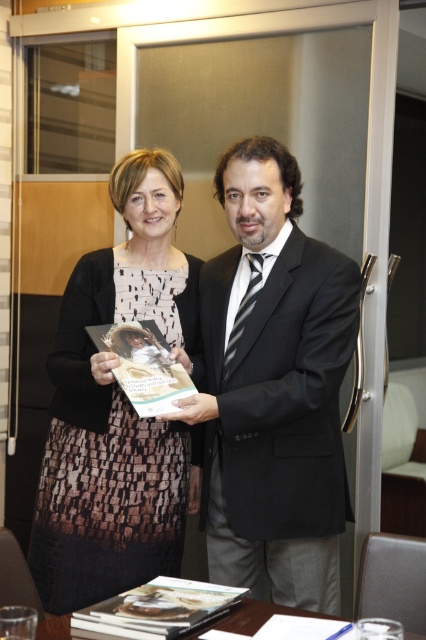
Question: Which of the following is the farthest from the observer?

Choices:
 (A) (49, 621)
 (B) (66, 596)
 (C) (348, 490)

Answer: (B)

Question: Which point is farther to the camera?

Choices:
 (A) black satin suit at center
 (B) wooden table at lower center
 (C) printed fabric dress at center

Answer: (C)

Question: Can you confirm if printed fabric dress at center is positioned to the left of wooden table at lower center?

Choices:
 (A) yes
 (B) no

Answer: (A)

Question: Which of these objects is positioned closest to the black satin suit at center?

Choices:
 (A) wooden table at lower center
 (B) printed fabric dress at center

Answer: (B)

Question: Does black satin suit at center appear over wooden table at lower center?

Choices:
 (A) no
 (B) yes

Answer: (B)

Question: Does printed fabric dress at center have a larger size compared to wooden table at lower center?

Choices:
 (A) no
 (B) yes

Answer: (B)